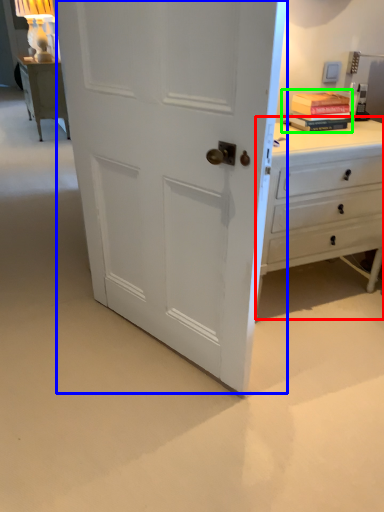
Question: Which object is positioned farthest from chest of drawers (highlighted by a red box)? Select from door (highlighted by a blue box) and book (highlighted by a green box).

Choices:
 (A) door
 (B) book

Answer: (A)